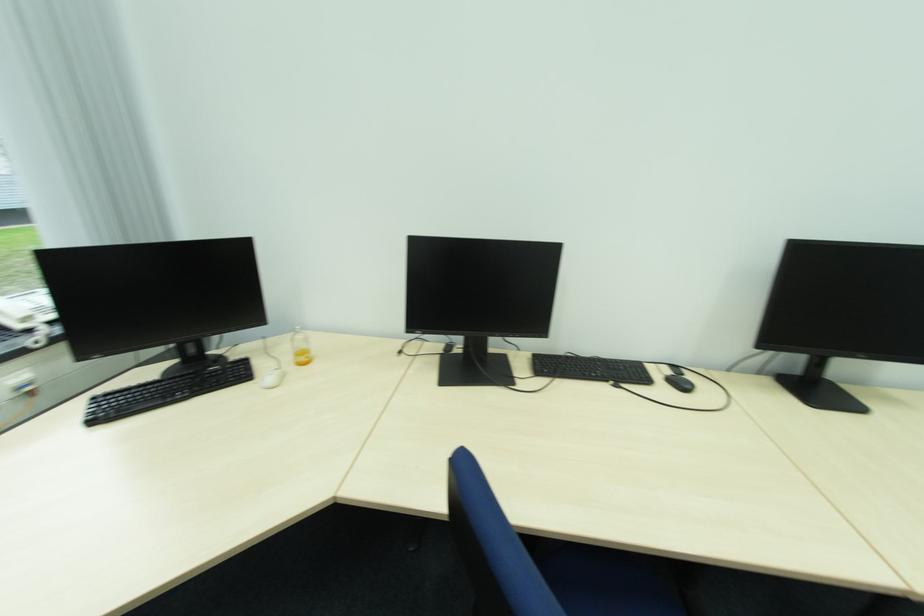
Locate an element on the screen. Image resolution: width=924 pixels, height=616 pixels. white computer mouse is located at coordinates (273, 378).